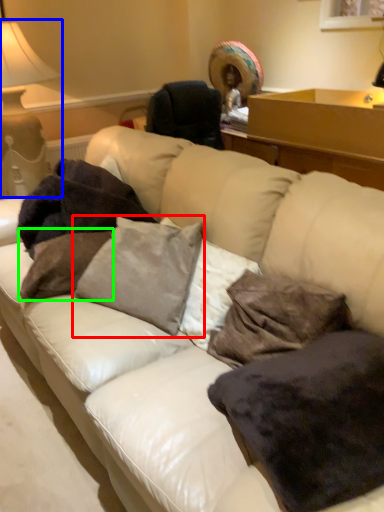
Question: Based on their relative distances, which object is farther from pillow (highlighted by a red box)? Choose from table lamp (highlighted by a blue box) and pillow (highlighted by a green box).

Choices:
 (A) table lamp
 (B) pillow

Answer: (A)